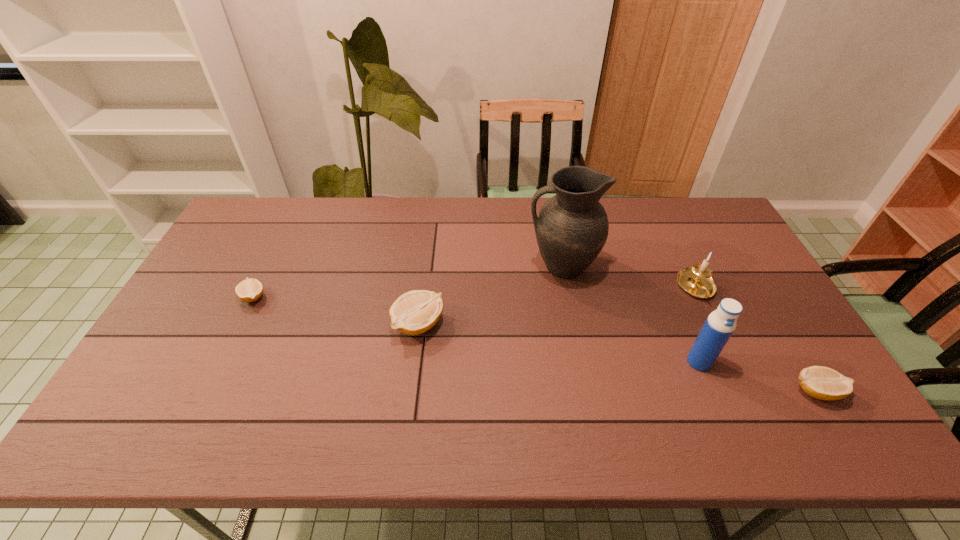
Identify the location of vacant region at the near left corner of the desktop. (169, 382).

I want to click on empty location between the shortest lemon and the third object from right to left, so click(x=476, y=329).

Locate an element on the screen. The width and height of the screenshot is (960, 540). empty space that is in between the second nearest object and the second shortest object is located at coordinates (757, 376).

I want to click on empty location between the fifth farthest object and the shortest lemon, so click(x=476, y=329).

This screenshot has height=540, width=960. Find the location of `vacant area that lies between the shortest lemon and the fourth object from right to left`. vacant area that lies between the shortest lemon and the fourth object from right to left is located at coordinates (408, 281).

Find the location of a particular element. The width and height of the screenshot is (960, 540). vacant space that is in between the third shortest object and the shortest object is located at coordinates (336, 310).

Find the location of `blank region between the shortest object and the rightmost object`. blank region between the shortest object and the rightmost object is located at coordinates (535, 344).

Find the location of a particular element. This screenshot has width=960, height=540. free area in between the fifth object from left to right and the tallest object is located at coordinates (629, 277).

This screenshot has height=540, width=960. Identify the location of vacant area that lies between the shortest object and the rightmost object. point(535,344).

You are a GUI agent. You are given a task and a screenshot of the screen. Output one action in this format:
    pyautogui.click(x=<x>, y=<y>)
    Task: Click on the vacant space that's between the nearest lemon and the second lemon from right to left
    The width and height of the screenshot is (960, 540).
    Given the screenshot: What is the action you would take?
    pyautogui.click(x=617, y=357)